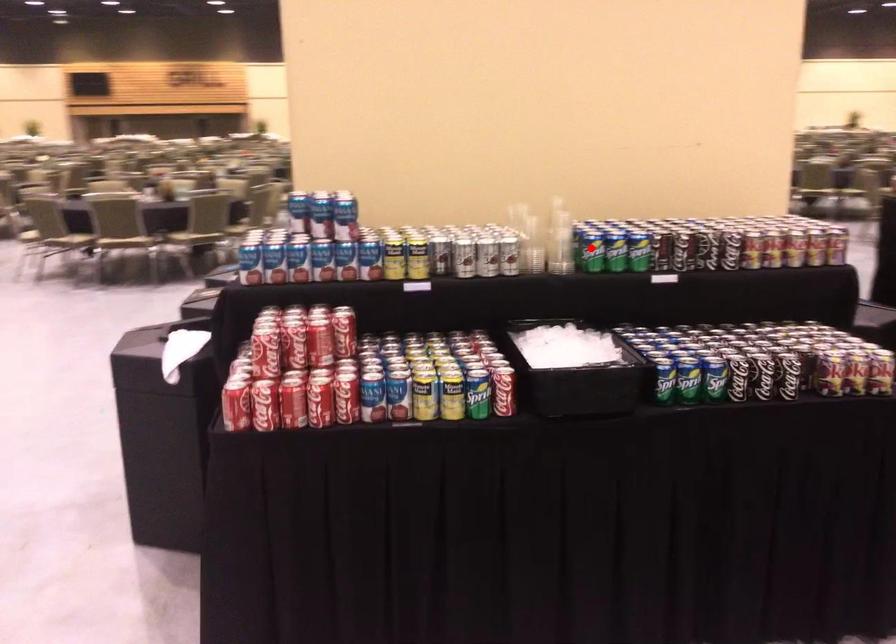
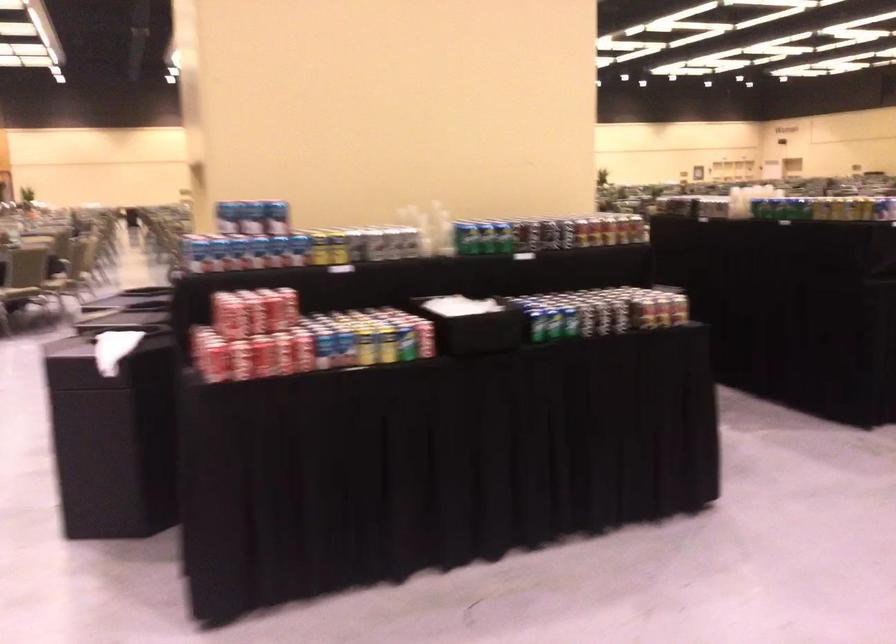
Question: I am providing you with two images of the same scene from different viewpoints. Given a red point in image1, look at the same physical point in image2. Is it:

Choices:
 (A) Closer to the viewpoint
 (B) Farther from the viewpoint

Answer: (B)